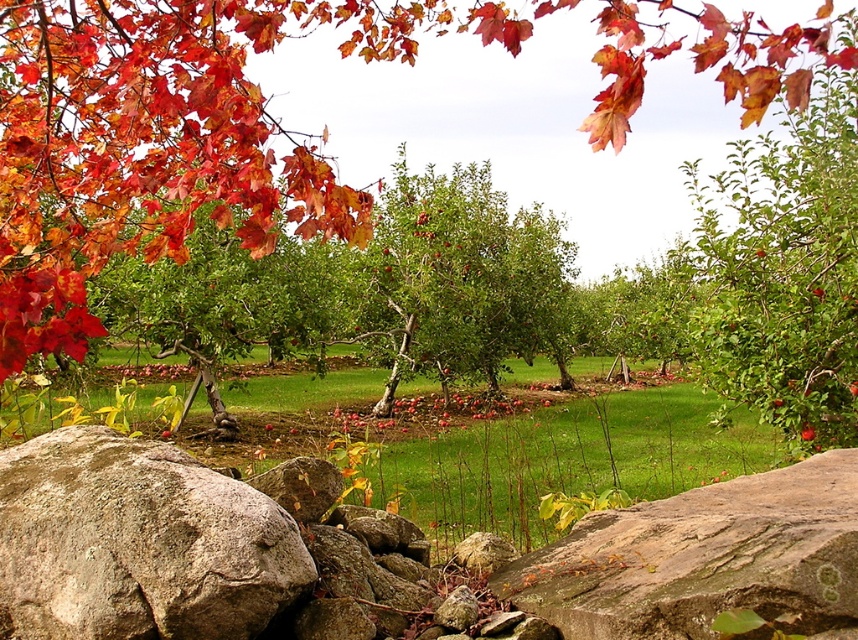
You are standing in the orchard looking at two points marked in the image. The first point is at coordinates point (150,550) and the second is at point (732,582). Which point is closer to you?

Point (150,550) is further to the camera than point (732,582), so the point closer to you is point (732,582).

You are standing at the center of the orchard looking towards the stone wall. Where is the gray rough boulder at lower left located in relation to your position?

The gray rough boulder at lower left is located at the lower left position relative to your viewpoint, as indicated by its 2D coordinates at point (x=137, y=541).

You are a gardener who wants to place a new small statue in the orchard. You have two options for placement spots near the gray rough boulder at lower left and brown rough rock at lower center. Since the statue is small, you prefer to place it next to the object that is smaller in size. Which object should you choose?

The gray rough boulder at lower left has a smaller size compared to brown rough rock at lower center, so you should place the statue next to the gray rough boulder at lower left.